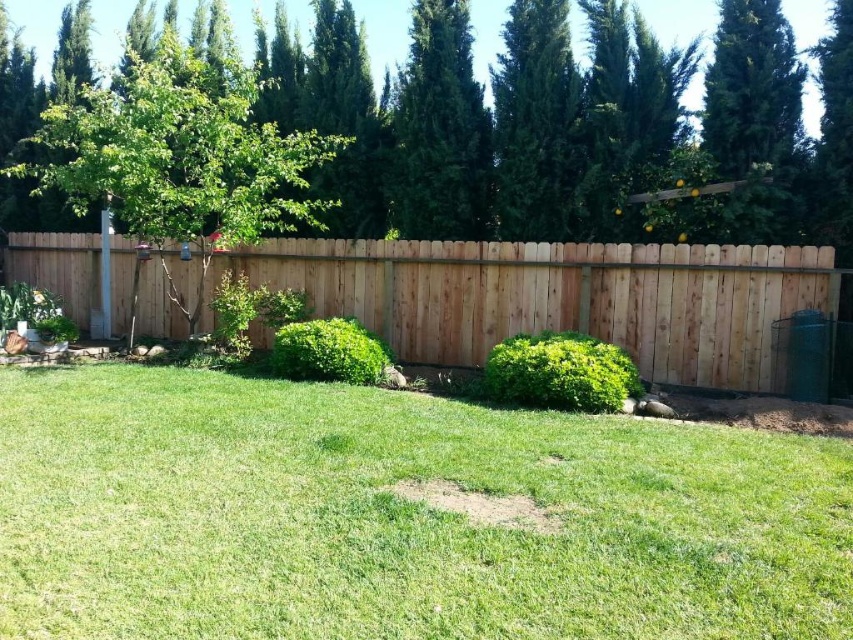
You are standing in the backyard and want to know which tree is taller between the green leafy tree at upper center and the green leafy tree at left. Can you determine this based on their positions?

The green leafy tree at upper center is not as tall as the green leafy tree at left, so the tree at the left is taller.

You are standing in the backyard and want to see the green leafy tree at left. Is the natural wood fence at center blocking your view of it?

The natural wood fence at center is in front of the green leafy tree at left, so it is blocking your view of the tree.

From the picture: You are planning to install a small garden in the backyard. You have two spots in mind, one where the green grass at center is and another where the green textured tree at upper center is. Which location would provide more space for planting? Please explain your reasoning based on the scene description.

The green grass at center has a smaller size compared to the green textured tree at upper center. Therefore, the area around the green textured tree at upper center would provide more space for planting since it occupies a larger area.